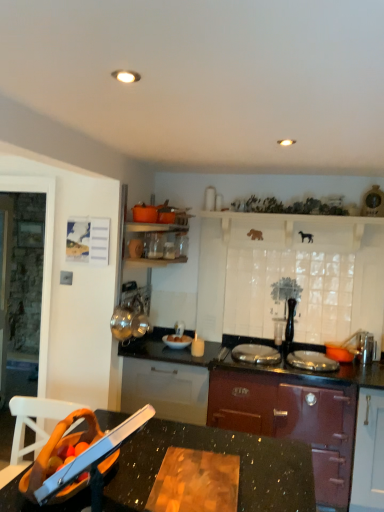
Question: Could you tell me if metallic sink at lower center is turned towards white glossy bowl at center?

Choices:
 (A) yes
 (B) no

Answer: (B)

Question: Is white glossy bowl at center at the back of metallic sink at lower center?

Choices:
 (A) no
 (B) yes

Answer: (A)

Question: Can you confirm if metallic sink at lower center is wider than white glossy bowl at center?

Choices:
 (A) yes
 (B) no

Answer: (A)

Question: Considering the relative sizes of metallic sink at lower center and white glossy bowl at center in the image provided, is metallic sink at lower center smaller than white glossy bowl at center?

Choices:
 (A) no
 (B) yes

Answer: (A)

Question: Would you consider metallic sink at lower center to be distant from white glossy bowl at center?

Choices:
 (A) no
 (B) yes

Answer: (B)

Question: Is the position of metallic sink at lower center more distant than that of white glossy bowl at center?

Choices:
 (A) yes
 (B) no

Answer: (B)

Question: Does matte burgundy stove at center come behind white matte cabinet at upper center?

Choices:
 (A) yes
 (B) no

Answer: (B)

Question: Can you confirm if matte burgundy stove at center is shorter than white matte cabinet at upper center?

Choices:
 (A) yes
 (B) no

Answer: (B)

Question: From a real-world perspective, is matte burgundy stove at center physically below white matte cabinet at upper center?

Choices:
 (A) yes
 (B) no

Answer: (A)

Question: Is matte burgundy stove at center looking in the opposite direction of white matte cabinet at upper center?

Choices:
 (A) no
 (B) yes

Answer: (A)

Question: Is matte burgundy stove at center taller than white matte cabinet at upper center?

Choices:
 (A) yes
 (B) no

Answer: (A)

Question: Is matte burgundy stove at center touching white matte cabinet at upper center?

Choices:
 (A) no
 (B) yes

Answer: (A)

Question: Does black granite countertop at lower center appear on the left side of white matte cabinet at upper center?

Choices:
 (A) yes
 (B) no

Answer: (A)